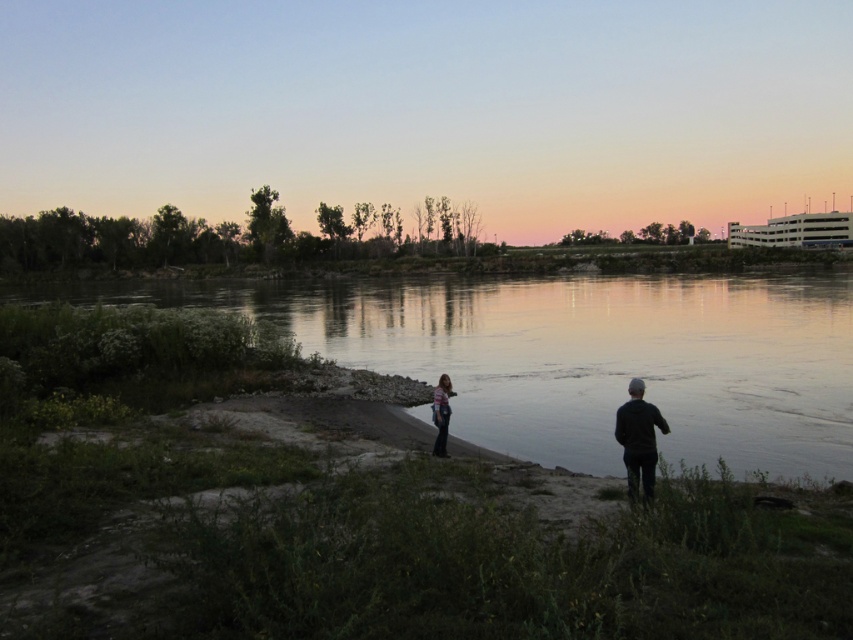
Question: Considering the relative positions of dark green jacket at lower right and striped fabric person at center in the image provided, where is dark green jacket at lower right located with respect to striped fabric person at center?

Choices:
 (A) above
 (B) below

Answer: (A)

Question: Can you confirm if smooth water at center is positioned to the left of dark green jacket at lower right?

Choices:
 (A) yes
 (B) no

Answer: (A)

Question: Which is nearer to the dark green jacket at lower right?

Choices:
 (A) smooth water at center
 (B) striped fabric person at center

Answer: (B)

Question: Does smooth water at center come behind striped fabric person at center?

Choices:
 (A) no
 (B) yes

Answer: (A)

Question: Which point appears farthest from the camera in this image?

Choices:
 (A) tap(631, 467)
 (B) tap(434, 397)
 (C) tap(618, 385)

Answer: (C)

Question: Among these objects, which one is nearest to the camera?

Choices:
 (A) dark green jacket at lower right
 (B) smooth water at center
 (C) striped fabric person at center

Answer: (B)